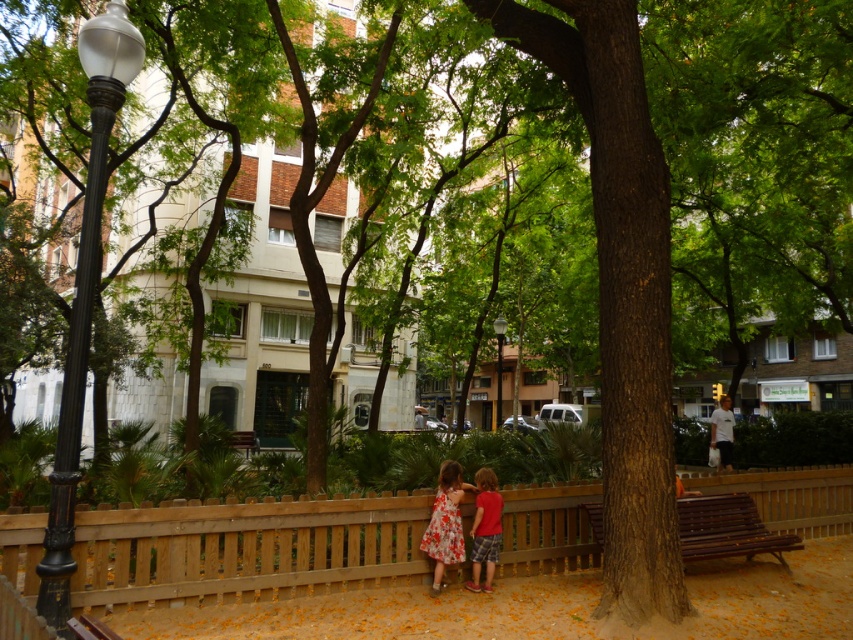
Does point (506, 522) lie behind point (590, 515)?

That is True.

Does wooden at lower center have a greater height compared to brown wooden bench at center?

No, wooden at lower center is not taller than brown wooden bench at center.

Identify the location of wooden at lower center. (247, 548).

Is wooden at lower center thinner than floral dress at center?

Yes.

Can you confirm if wooden at lower center is taller than floral dress at center?

In fact, wooden at lower center may be shorter than floral dress at center.

Who is more forward, (534, 512) or (440, 582)?

Point (440, 582) is in front.

You are a GUI agent. You are given a task and a screenshot of the screen. Output one action in this format:
    pyautogui.click(x=<x>, y=<y>)
    Task: Click on the wooden at lower center
    The height and width of the screenshot is (640, 853).
    Given the screenshot: What is the action you would take?
    pyautogui.click(x=247, y=548)

Can you confirm if wooden at lower center is bigger than black polished metal lamp post at left?

No, wooden at lower center is not bigger than black polished metal lamp post at left.

Which is below, wooden at lower center or black polished metal lamp post at left?

wooden at lower center is lower down.

Which is behind, point (581, 529) or point (113, 40)?

Positioned behind is point (581, 529).

The height and width of the screenshot is (640, 853). Identify the location of wooden at lower center. (247, 548).